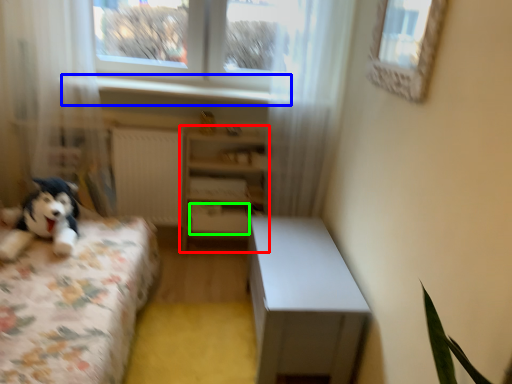
Question: Estimate the real-world distances between objects in this image. Which object is closer to shelf (highlighted by a red box), window sill (highlighted by a blue box) or drawer (highlighted by a green box)?

Choices:
 (A) window sill
 (B) drawer

Answer: (B)